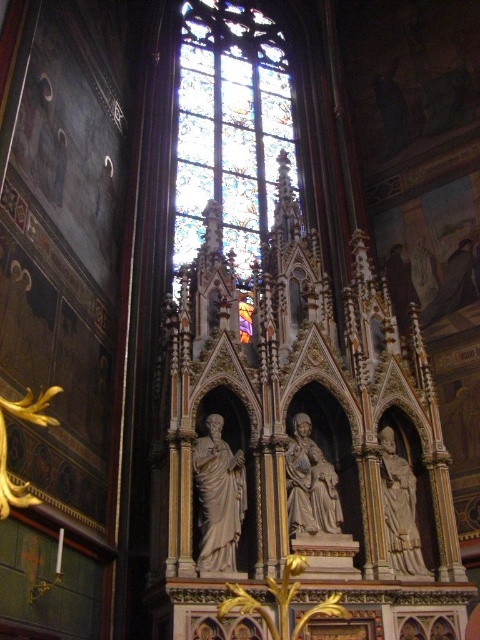
You are an architect designing a new cathedral and want to ensure proper lighting for the stained glass window at center and the matte stone statue at center. Given their positions and sizes, which object will cast a larger shadow on the floor?

The stained glass window at center has a greater height compared to the matte stone statue at center, so it will cast a larger shadow on the floor.

You are standing in the cathedral and want to take a photo of the stained glass window at center. To ensure the statues are not blocking your view, where should you position yourself relative to the window?

The stained glass window at center is located at point (229, 125), so you should position yourself directly in front of it to avoid the statues blocking your view.

You are an art student visiting the cathedral and want to sketch the stained glass window at center and the matte stone statue at center. Since you have limited time, you need to decide which one to sketch first based on their sizes. Which object should you choose to sketch first?

The stained glass window at center is larger in size than the matte stone statue at center, so you should sketch the stained glass window at center first as it requires more attention due to its size.